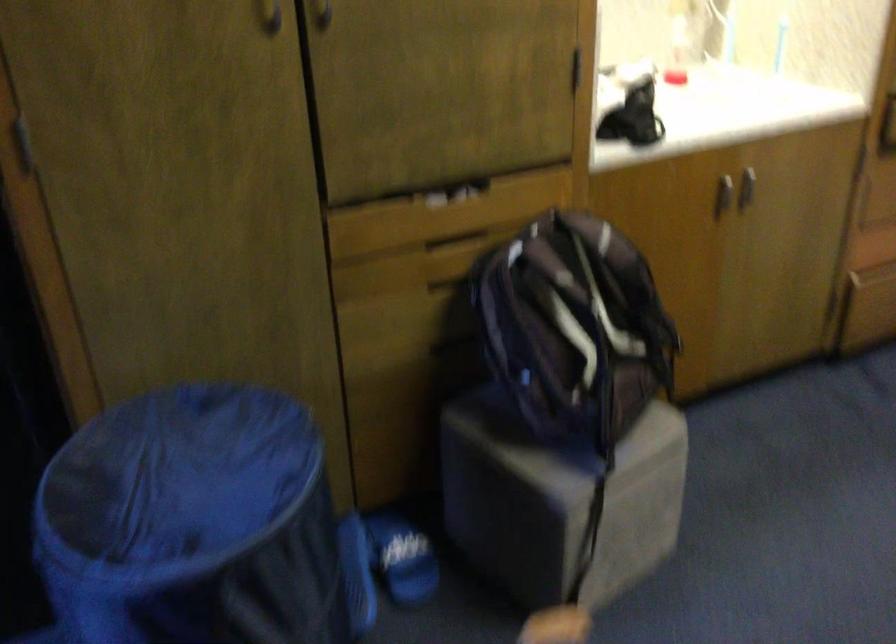
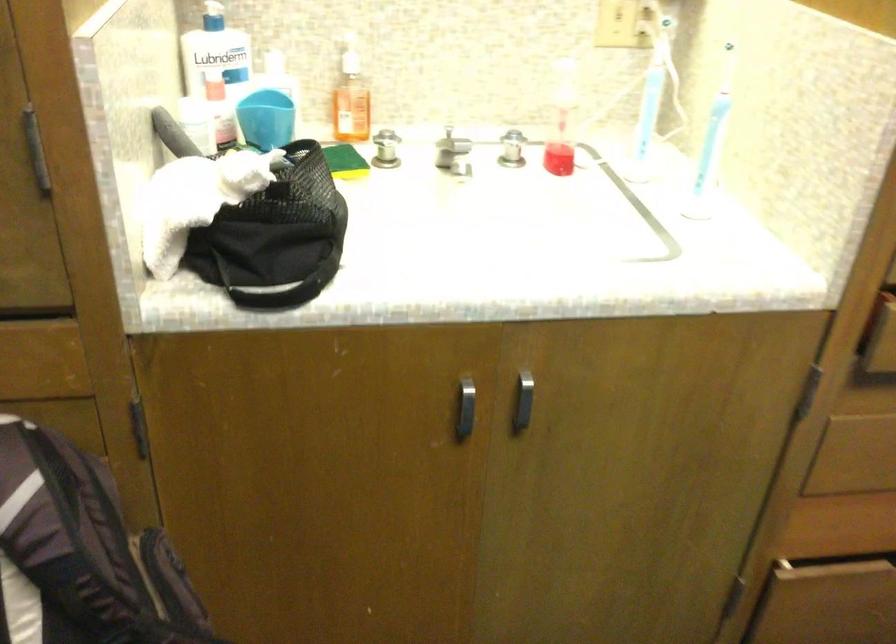
Locate, in the second image, the point that corresponds to point 746,182 in the first image.

(522, 402)